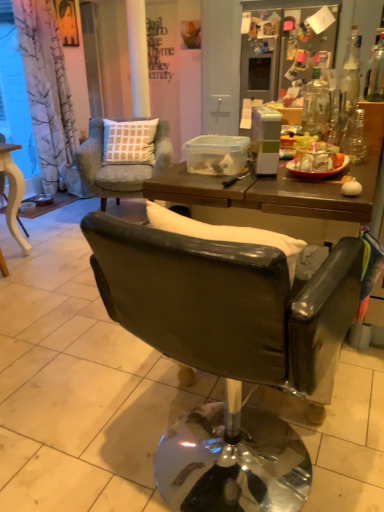
Describe the element at coordinates (315, 104) in the screenshot. I see `clear glass bottle at upper right, the 1th bottle positioned from the left` at that location.

Image resolution: width=384 pixels, height=512 pixels. What do you see at coordinates (227, 303) in the screenshot?
I see `leather-like black chair at center, the 1th chair positioned from the right` at bounding box center [227, 303].

What do you see at coordinates (350, 74) in the screenshot?
I see `transparent glass bottle at upper right, the 1th bottle viewed from the right` at bounding box center [350, 74].

Locate an element on the screen. This screenshot has height=512, width=384. clear glass bottle at upper right, the 3th bottle from the right is located at coordinates (315, 104).

Find the location of a particular element. The width and height of the screenshot is (384, 512). refrigerator above the brown wooden table at center (from a real-world perspective) is located at coordinates (296, 37).

Is brown wooden table at center taller or shorter than satin silver refrigerator at upper right?

brown wooden table at center is shorter than satin silver refrigerator at upper right.

From the image's perspective, would you say brown wooden table at center is shown under satin silver refrigerator at upper right?

Correct, brown wooden table at center appears lower than satin silver refrigerator at upper right in the image.

From a real-world perspective, which object rests below the other?

brown wooden table at center, from a real-world perspective.

Is leather-like black chair at center, the 1th chair positioned from the right, touching matte black portrait at upper left?

No.

Measure the distance between leather-like black chair at center, which is the third chair in back-to-front order, and matte black portrait at upper left.

A distance of 13.32 feet exists between leather-like black chair at center, which is the third chair in back-to-front order, and matte black portrait at upper left.

Which is in front, leather-like black chair at center, the 1th chair positioned from the right, or matte black portrait at upper left?

leather-like black chair at center, the 1th chair positioned from the right, is closer to the camera.

From the image's perspective, which one is positioned lower, leather-like black chair at center, the 1th chair in the front-to-back sequence, or matte black portrait at upper left?

leather-like black chair at center, the 1th chair in the front-to-back sequence, is shown below in the image.

Consider the image. Between transparent glass bottle at upper right, the 1th bottle viewed from the right, and matte black portrait at upper left, which one has larger size?

matte black portrait at upper left.

From a real-world perspective, is transparent glass bottle at upper right, which ranks as the third bottle in left-to-right order, positioned above or below matte black portrait at upper left?

transparent glass bottle at upper right, which ranks as the third bottle in left-to-right order, is situated lower than matte black portrait at upper left in the real world.

Could you tell me if transparent glass bottle at upper right, the 1th bottle viewed from the right, is turned towards matte black portrait at upper left?

No, transparent glass bottle at upper right, the 1th bottle viewed from the right, does not turn towards matte black portrait at upper left.

Is transparent glass bottle at upper right, the 1th bottle viewed from the right, further to the viewer compared to matte black portrait at upper left?

No, it is not.

Between light blue fabric chair at upper left, arranged as the second chair when viewed from the left, and transparent glass bottle at upper right, the 1th bottle viewed from the right, which one appears on the left side from the viewer's perspective?

From the viewer's perspective, light blue fabric chair at upper left, arranged as the second chair when viewed from the left, appears more on the left side.

Looking at their sizes, would you say light blue fabric chair at upper left, which ranks as the 2th chair in right-to-left order, is wider or thinner than transparent glass bottle at upper right, the 1th bottle viewed from the right?

Considering their sizes, light blue fabric chair at upper left, which ranks as the 2th chair in right-to-left order, looks broader than transparent glass bottle at upper right, the 1th bottle viewed from the right.

In terms of height, does light blue fabric chair at upper left, which ranks as the 2th chair in right-to-left order, look taller or shorter compared to transparent glass bottle at upper right, which ranks as the third bottle in left-to-right order?

light blue fabric chair at upper left, which ranks as the 2th chair in right-to-left order, is taller than transparent glass bottle at upper right, which ranks as the third bottle in left-to-right order.

The image size is (384, 512). Identify the location of the 3rd chair positioned below the transparent glass bottle at upper right, which ranks as the third bottle in left-to-right order (from a real-world perspective). pyautogui.click(x=119, y=165).

Is light blue fabric chair at upper left, which is the 1th chair in back-to-front order, far from satin silver refrigerator at upper right?

Absolutely, light blue fabric chair at upper left, which is the 1th chair in back-to-front order, is distant from satin silver refrigerator at upper right.

Based on the photo, does light blue fabric chair at upper left, which appears as the third chair when viewed from the front, lie behind satin silver refrigerator at upper right?

No, it is in front of satin silver refrigerator at upper right.

Based on their sizes in the image, would you say light blue fabric chair at upper left, which is the 1th chair in back-to-front order, is bigger or smaller than satin silver refrigerator at upper right?

In the image, light blue fabric chair at upper left, which is the 1th chair in back-to-front order, appears to be larger than satin silver refrigerator at upper right.

Which is behind, leather-like black chair at center, which is the third chair in back-to-front order, or transparent glass bottle at right, which is the second bottle in right-to-left order?

transparent glass bottle at right, which is the second bottle in right-to-left order, is behind.

How distant is leather-like black chair at center, the 1th chair in the front-to-back sequence, from transparent glass bottle at right, the second bottle from the left?

leather-like black chair at center, the 1th chair in the front-to-back sequence, is 93.32 centimeters from transparent glass bottle at right, the second bottle from the left.

Is leather-like black chair at center, which ranks as the 3th chair in left-to-right order, facing towards transparent glass bottle at right, the second bottle from the left?

Yes, leather-like black chair at center, which ranks as the 3th chair in left-to-right order, faces towards transparent glass bottle at right, the second bottle from the left.

From their relative heights in the image, would you say leather-like black chair at center, which is the third chair in back-to-front order, is taller or shorter than transparent glass bottle at right, the second bottle from the left?

leather-like black chair at center, which is the third chair in back-to-front order, is taller than transparent glass bottle at right, the second bottle from the left.

Considering the positions of objects leather-like black chair at center, the 1th chair in the front-to-back sequence, and matte yellow wooden table at left, arranged as the 2th chair when viewed from the front, in the image provided, who is more to the left, leather-like black chair at center, the 1th chair in the front-to-back sequence, or matte yellow wooden table at left, arranged as the 2th chair when viewed from the front,?

Positioned to the left is matte yellow wooden table at left, arranged as the 2th chair when viewed from the front.

At what (x,y) coordinates should I click in order to perform the action: click on chair that appears above the matte yellow wooden table at left, which ranks as the 3th chair in right-to-left order (from a real-world perspective). Please return your answer as a coordinate pair (x, y). This screenshot has height=512, width=384. Looking at the image, I should click on (227, 303).

From a real-world perspective, which is physically above, leather-like black chair at center, which ranks as the 3th chair in left-to-right order, or matte yellow wooden table at left, arranged as the 2th chair when viewed from the front?

leather-like black chair at center, which ranks as the 3th chair in left-to-right order, from a real-world perspective.

From the picture: From the image's perspective, which one is positioned lower, leather-like black chair at center, the 1th chair positioned from the right, or matte yellow wooden table at left, the 2th chair from the back?

leather-like black chair at center, the 1th chair positioned from the right, from the image's perspective.

Locate an element on the screen. refrigerator behind the brown wooden table at center is located at coordinates (296, 37).

Find the location of a particular element. Image resolution: width=384 pixels, height=512 pixels. person on the left of leather-like black chair at center, which is the third chair in back-to-front order is located at coordinates (67, 22).

Considering their positions, is transparent glass bottle at upper right, which ranks as the third bottle in left-to-right order, positioned closer to transparent glass bottle at right, the second bottle from the left, than brown wooden table at center?

Among the two, brown wooden table at center is located nearer to transparent glass bottle at right, the second bottle from the left.

From the image, which object appears to be nearer to brown wooden table at center, transparent glass bottle at right, the second bottle from the left, or leather-like black chair at center, the 1th chair positioned from the right?

leather-like black chair at center, the 1th chair positioned from the right.

From the image, which object appears to be nearer to brown wooden table at center, transparent glass bottle at upper right, which ranks as the third bottle in left-to-right order, or leather-like black chair at center, which is the third chair in back-to-front order?

leather-like black chair at center, which is the third chair in back-to-front order, lies closer to brown wooden table at center than the other object.

Which object lies nearer to the anchor point matte yellow wooden table at left, the 1th chair viewed from the left, leather-like black chair at center, which is the third chair in back-to-front order, or transparent glass bottle at right, which is the second bottle in right-to-left order?

transparent glass bottle at right, which is the second bottle in right-to-left order, is closer to matte yellow wooden table at left, the 1th chair viewed from the left.

Estimate the real-world distances between objects in this image. Which object is closer to satin silver refrigerator at upper right, light blue fabric chair at upper left, which appears as the third chair when viewed from the front, or transparent glass bottle at right, the second bottle from the left?

light blue fabric chair at upper left, which appears as the third chair when viewed from the front, is positioned closer to the anchor satin silver refrigerator at upper right.

From the image, which object appears to be farther from transparent glass bottle at right, the second bottle from the left, light blue fabric chair at upper left, which ranks as the 2th chair in right-to-left order, or matte yellow wooden table at left, the 1th chair viewed from the left?

matte yellow wooden table at left, the 1th chair viewed from the left, is positioned further to the anchor transparent glass bottle at right, the second bottle from the left.

When comparing their distances from light blue fabric chair at upper left, which appears as the third chair when viewed from the front, does transparent glass bottle at right, the second bottle from the left, or transparent glass bottle at upper right, the 1th bottle viewed from the right, seem closer?

Based on the image, transparent glass bottle at right, the second bottle from the left, appears to be nearer to light blue fabric chair at upper left, which appears as the third chair when viewed from the front.

Consider the image. When comparing their distances from light blue fabric chair at upper left, which is the 1th chair in back-to-front order, does leather-like black chair at center, which is the third chair in back-to-front order, or clear glass bottle at upper right, the 1th bottle positioned from the left, seem closer?

Based on the image, clear glass bottle at upper right, the 1th bottle positioned from the left, appears to be nearer to light blue fabric chair at upper left, which is the 1th chair in back-to-front order.

Locate an element on the screen. This screenshot has height=512, width=384. table located between leather-like black chair at center, the 1th chair positioned from the right, and transparent glass bottle at right, which is the second bottle in right-to-left order, in the depth direction is located at coordinates (272, 197).

Image resolution: width=384 pixels, height=512 pixels. In order to click on table between matte yellow wooden table at left, the 1th chair viewed from the left, and transparent glass bottle at upper right, the 1th bottle viewed from the right, in the horizontal direction in this screenshot , I will do `click(272, 197)`.

At what (x,y) coordinates should I click in order to perform the action: click on chair between matte black portrait at upper left and matte yellow wooden table at left, arranged as the 2th chair when viewed from the front, in the vertical direction. Please return your answer as a coordinate pair (x, y). The width and height of the screenshot is (384, 512). Looking at the image, I should click on (119, 165).

I want to click on person between matte yellow wooden table at left, arranged as the 2th chair when viewed from the front, and transparent glass bottle at upper right, the 1th bottle viewed from the right, in the horizontal direction, so click(x=67, y=22).